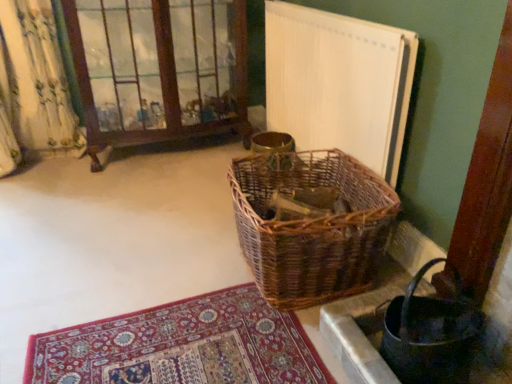
Locate an element on the screen. This screenshot has height=384, width=512. vacant area to the left of woven brown picnic basket at center is located at coordinates (173, 269).